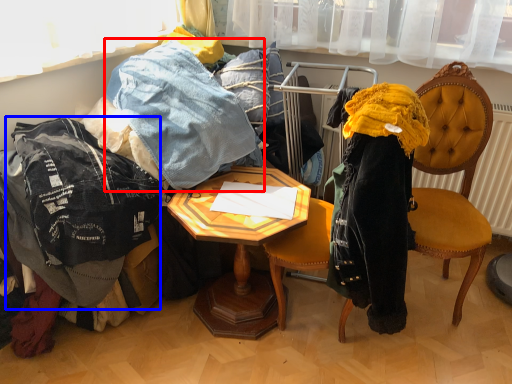
Question: Which of the following is the farthest to the observer, trousers (highlighted by a red box) or clothing (highlighted by a blue box)?

Choices:
 (A) trousers
 (B) clothing

Answer: (A)